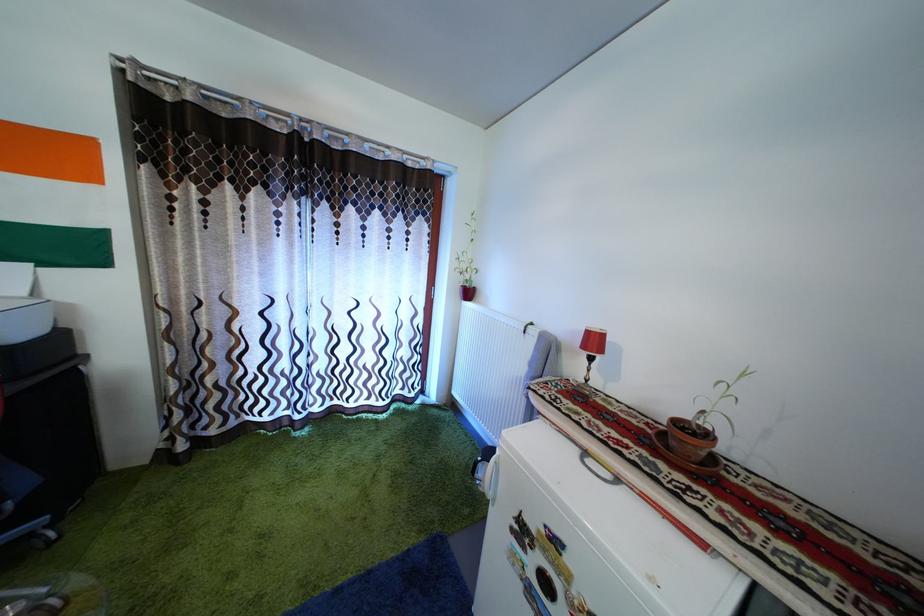
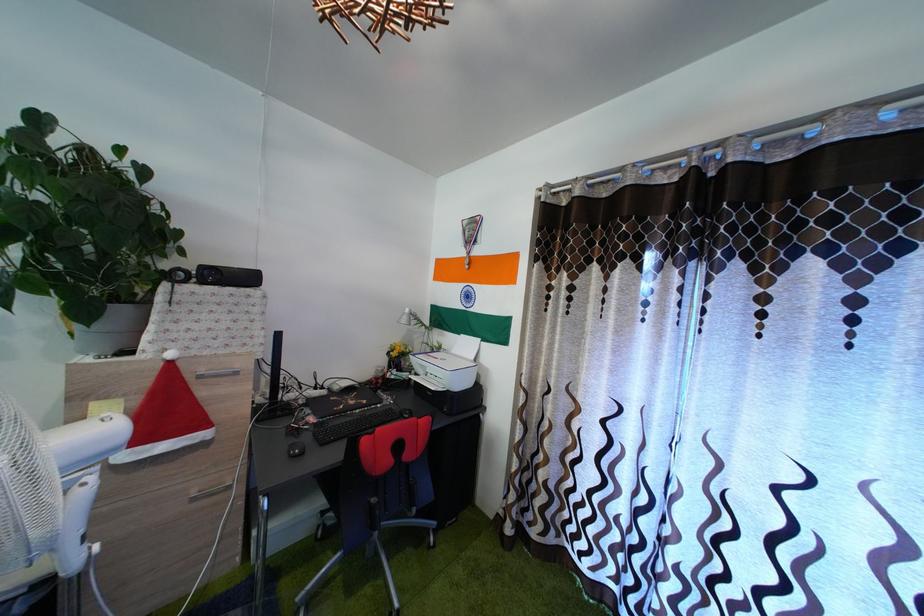
Question: How did the camera likely rotate?

Choices:
 (A) Left
 (B) Right
 (C) Up
 (D) Down

Answer: (A)